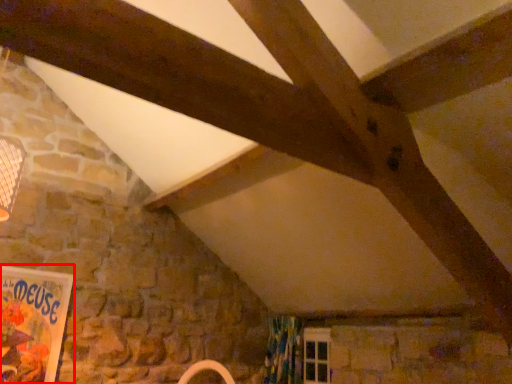
Question: From the image's perspective, where is bulletin board (annotated by the red box) located relative to curtain?

Choices:
 (A) below
 (B) above

Answer: (B)